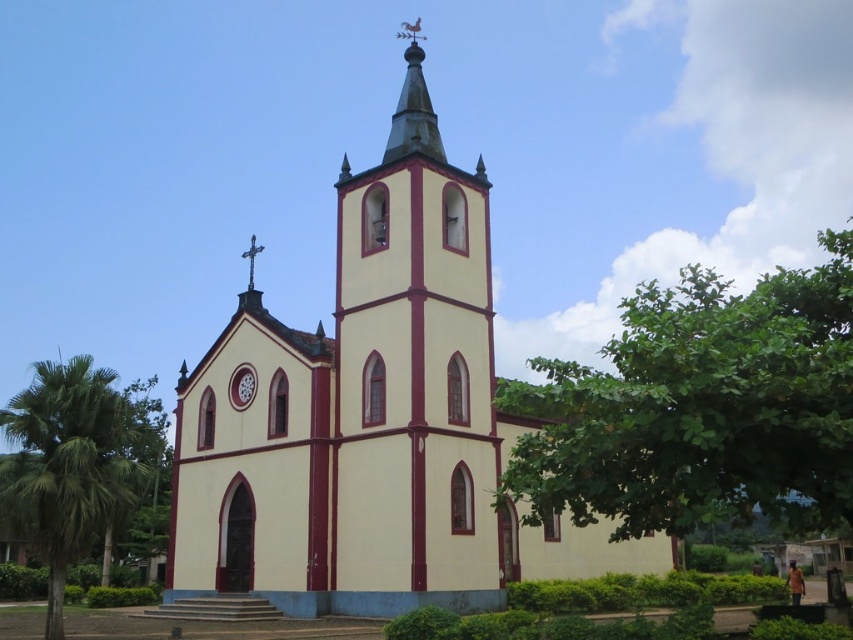
Does green leafy tree at right have a greater width compared to metallic spire at upper center?

Indeed, green leafy tree at right has a greater width compared to metallic spire at upper center.

Which of these two, green leafy tree at right or metallic spire at upper center, stands shorter?

metallic spire at upper center is shorter.

This screenshot has height=640, width=853. What do you see at coordinates (701, 408) in the screenshot?
I see `green leafy tree at right` at bounding box center [701, 408].

Locate an element on the screen. green leafy tree at right is located at coordinates (701, 408).

Who is shorter, beige stucco church at center or matte red clock at center?

matte red clock at center

Who is lower down, beige stucco church at center or matte red clock at center?

Positioned lower is beige stucco church at center.

Locate an element on the screen. This screenshot has width=853, height=640. beige stucco church at center is located at coordinates (370, 429).

Image resolution: width=853 pixels, height=640 pixels. I want to click on beige stucco church at center, so click(370, 429).

Who is shorter, green leafy tree at right or matte red clock at center?

With less height is matte red clock at center.

Is point (651, 365) less distant than point (241, 369)?

Yes, point (651, 365) is in front of point (241, 369).

Between point (825, 468) and point (247, 403), which one is positioned behind?

Point (247, 403)

This screenshot has height=640, width=853. I want to click on green leafy tree at right, so click(701, 408).